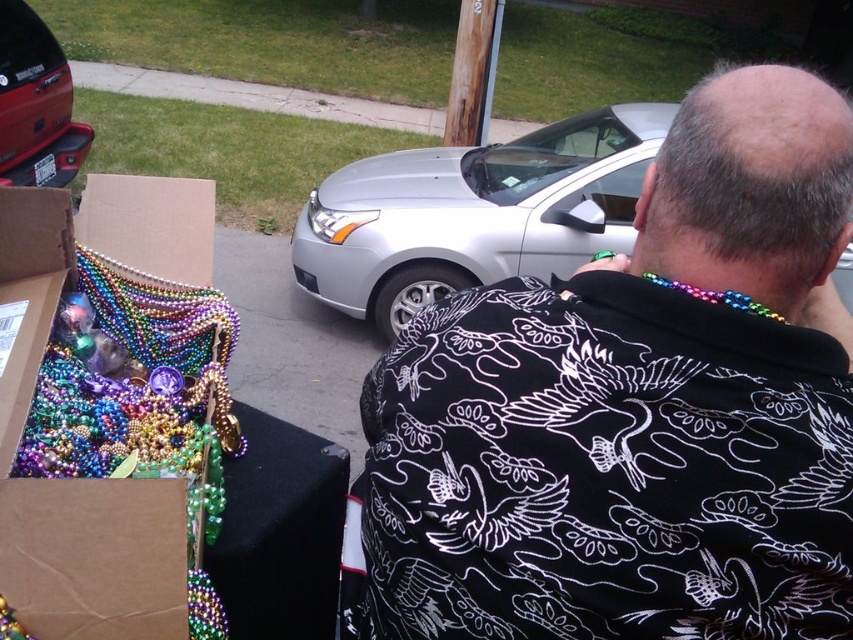
Who is lower down, black printed shirt at center or silver metallic car at center?

Positioned lower is black printed shirt at center.

Does black printed shirt at center have a greater height compared to silver metallic car at center?

No, black printed shirt at center is not taller than silver metallic car at center.

Which is in front, point (770, 182) or point (363, 250)?

Positioned in front is point (770, 182).

The image size is (853, 640). I want to click on black printed shirt at center, so click(x=635, y=410).

Is point (424, 157) positioned after point (28, 97)?

No, it is not.

Which is in front, point (602, 150) or point (3, 99)?

Point (602, 150) is in front.

Who is more distant from viewer, (354, 220) or (10, 102)?

Point (10, 102)

Identify the location of silver metallic car at center. Image resolution: width=853 pixels, height=640 pixels. (474, 212).

The image size is (853, 640). What do you see at coordinates (635, 410) in the screenshot?
I see `black printed shirt at center` at bounding box center [635, 410].

Does black printed shirt at center have a greater width compared to matte red car at upper left?

Correct, the width of black printed shirt at center exceeds that of matte red car at upper left.

Does point (637, 614) come farther from viewer compared to point (25, 116)?

No, it is in front of (25, 116).

Find the location of a particular element. The height and width of the screenshot is (640, 853). black printed shirt at center is located at coordinates (635, 410).